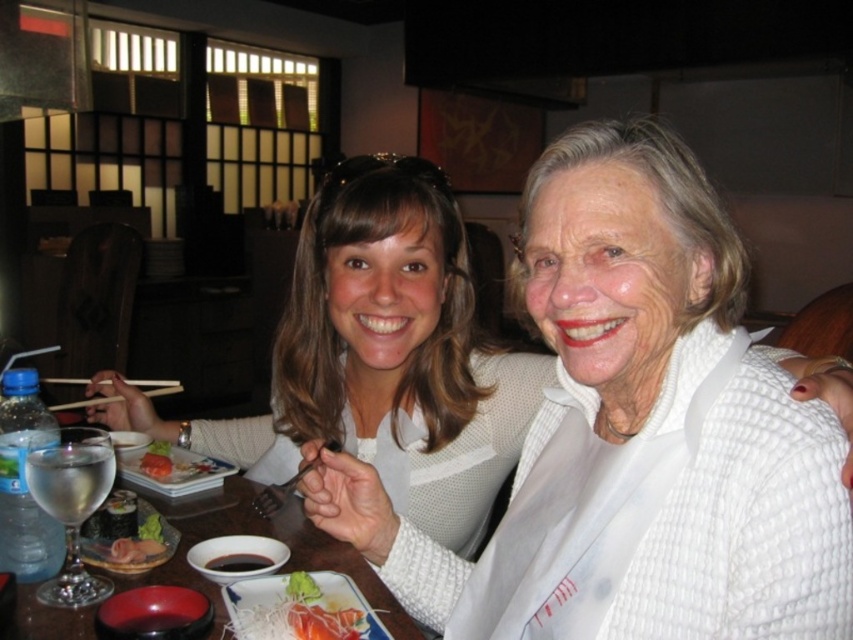
You are a waiter in a restaurant and need to place a new menu between the wooden chopsticks at left and the black glossy soy sauce at center. Based on their heights, which object should you place the menu closer to?

The wooden chopsticks at left are taller than the black glossy soy sauce at center, so you should place the menu closer to the wooden chopsticks at left to ensure it stands upright.

You are a server at the restaurant and need to place a 3cm wide condiment bottle between the wooden chopsticks at left and the black glossy soy sauce at center. Can you fit it there?

The wooden chopsticks at left are wider than the black glossy soy sauce at center. Since the chopsticks are wider, there might be enough space between them to fit the 3cm condiment bottle, but it depends on the exact distance between the two objects. However, since the chopsticks are wider, the space between them could accommodate the bottle if positioned correctly.

You are a waiter in a restaurant and need to place a small bowl of soy sauce between the white textured sweater at center and the black glossy soy sauce at center. Which object should you place the bowl closer to?

The white textured sweater at center is closer to the viewer than the black glossy soy sauce at center, so you should place the bowl closer to the black glossy soy sauce at center to ensure it is positioned between them.